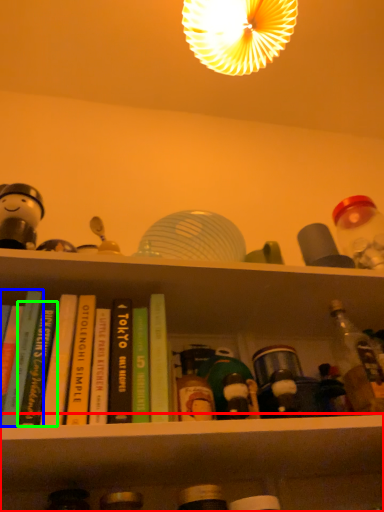
Question: Which object is the farthest from shelf (highlighted by a red box)? Choose among these: book (highlighted by a blue box) or book (highlighted by a green box).

Choices:
 (A) book
 (B) book

Answer: (A)